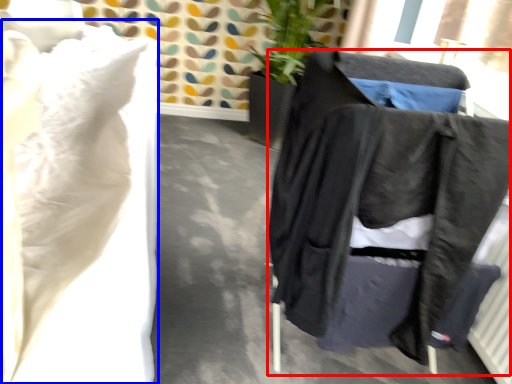
Question: Which object appears farthest to the camera in this image, furniture (highlighted by a red box) or sheet (highlighted by a blue box)?

Choices:
 (A) furniture
 (B) sheet

Answer: (A)